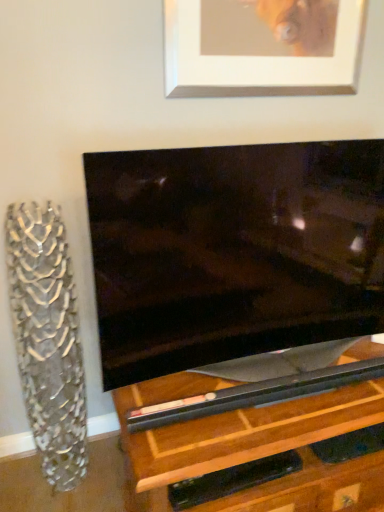
Question: Is clear glass vase at left inside the boundaries of silver/metallic picture frame at upper center, or outside?

Choices:
 (A) outside
 (B) inside

Answer: (A)

Question: Is clear glass vase at left bigger or smaller than silver/metallic picture frame at upper center?

Choices:
 (A) big
 (B) small

Answer: (A)

Question: From the image's perspective, is clear glass vase at left located above or below silver/metallic picture frame at upper center?

Choices:
 (A) below
 (B) above

Answer: (A)

Question: Choose the correct answer: Is silver/metallic picture frame at upper center inside clear glass vase at left or outside it?

Choices:
 (A) outside
 (B) inside

Answer: (A)

Question: From a real-world perspective, is silver/metallic picture frame at upper center physically located above or below clear glass vase at left?

Choices:
 (A) above
 (B) below

Answer: (A)

Question: From their relative heights in the image, would you say silver/metallic picture frame at upper center is taller or shorter than clear glass vase at left?

Choices:
 (A) short
 (B) tall

Answer: (A)

Question: Would you say silver/metallic picture frame at upper center is to the left or to the right of clear glass vase at left in the picture?

Choices:
 (A) right
 (B) left

Answer: (A)